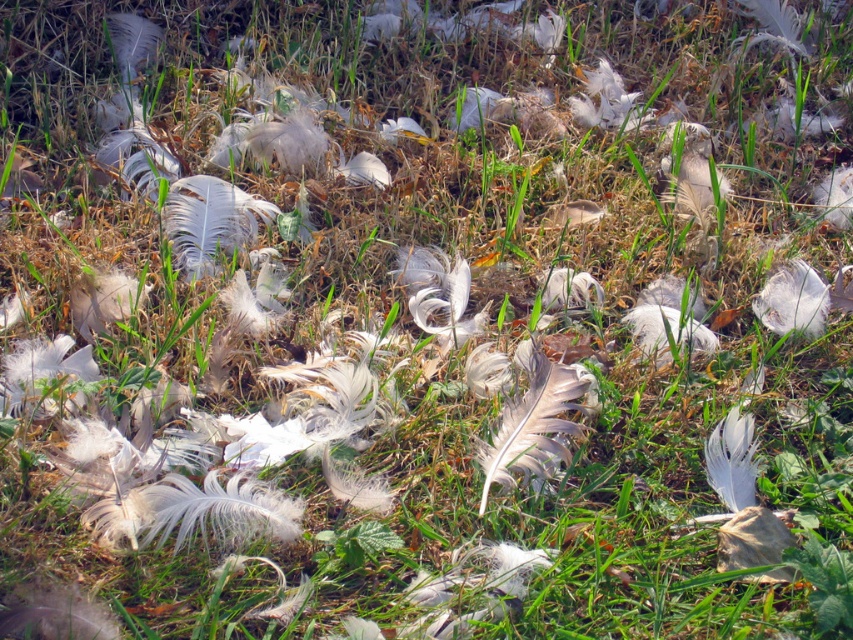
You are a bird enthusiast examining the feathers in the scene. You notice two specific feathers, the white soft feather at center and the white feather at upper right. Which of these two feathers is wider?

The white soft feather at center is wider than the white feather at upper right.